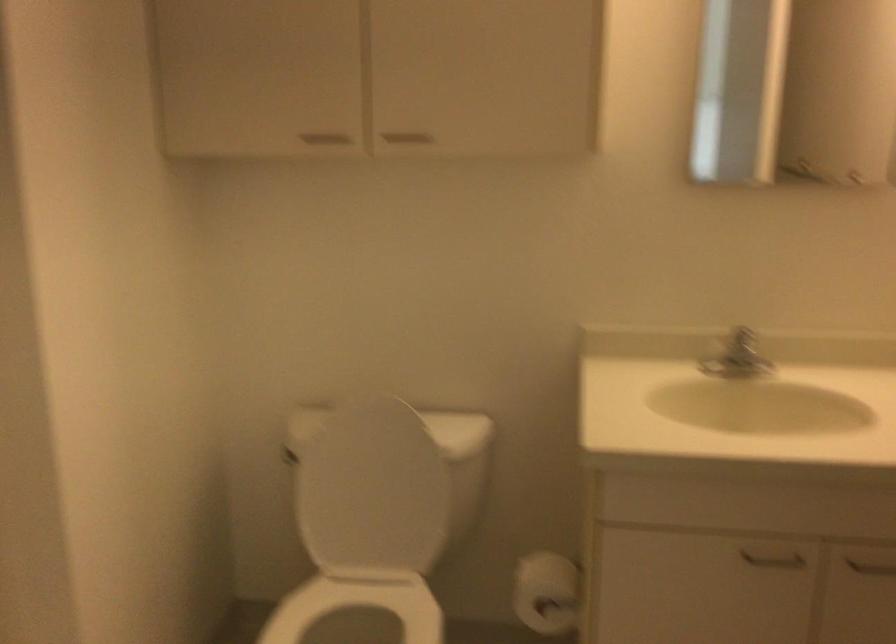
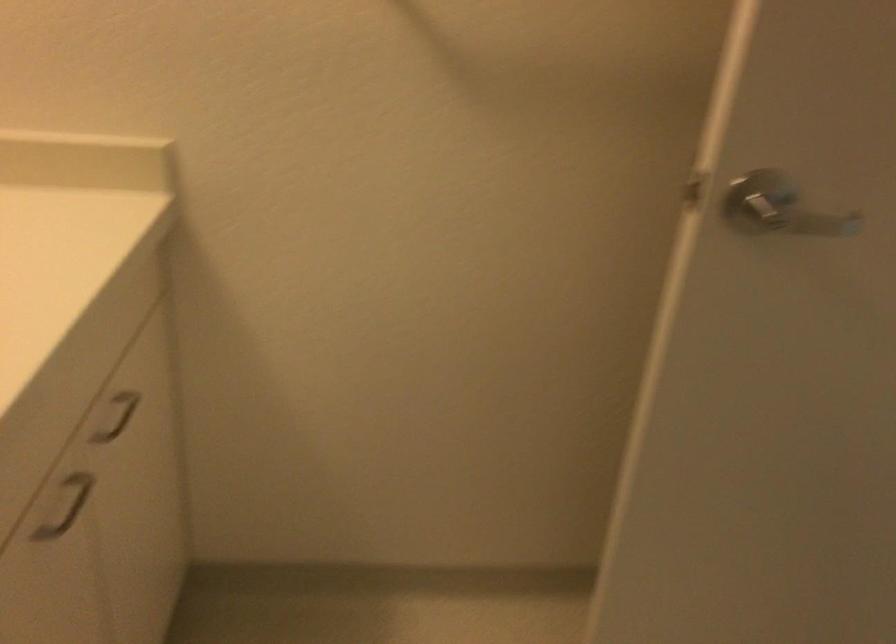
Find the pixel in the second image that matches the point at 763,353 in the first image.

(64, 507)